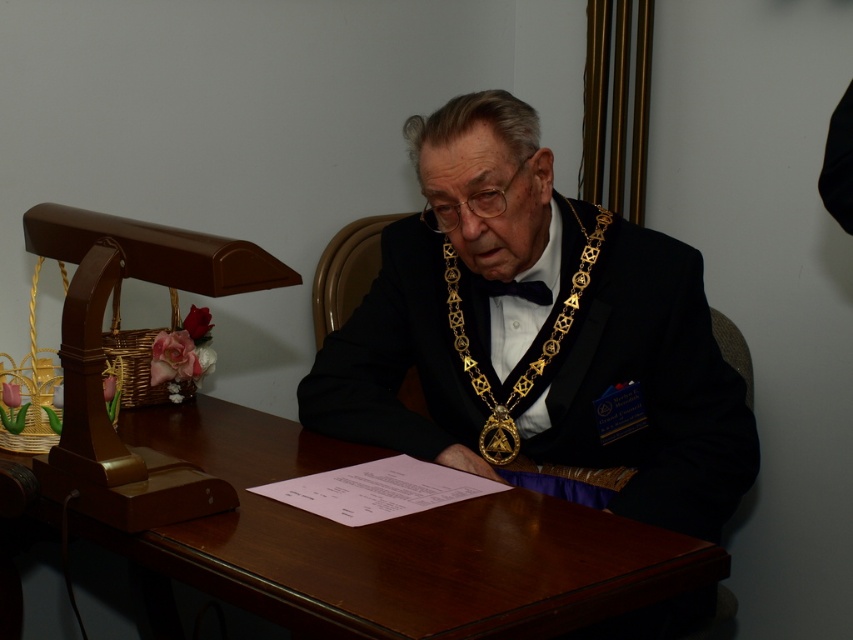
Is black satin suit at center thinner than brown wood table at center?

Correct, black satin suit at center's width is less than brown wood table at center's.

Between black satin suit at center and brown wood table at center, which one has less height?

Standing shorter between the two is brown wood table at center.

Where is `black satin suit at center`? black satin suit at center is located at coordinates (537, 332).

Can you confirm if brown wood table at center is taller than gold metallic chain at center?

No.

From the picture: Between brown wood table at center and gold metallic chain at center, which one is positioned higher?

Positioned higher is gold metallic chain at center.

Which is behind, point (450, 598) or point (581, 264)?

The point (581, 264) is more distant.

Locate an element on the screen. This screenshot has height=640, width=853. brown wood table at center is located at coordinates (393, 545).

Is point (537, 371) behind point (456, 288)?

No, it is in front of (456, 288).

Which of these two, black satin suit at center or gold metallic chain at center, stands shorter?

With less height is gold metallic chain at center.

Who is more forward, (x=518, y=314) or (x=556, y=323)?

Point (x=556, y=323) is more forward.

Identify the location of black satin suit at center. (537, 332).